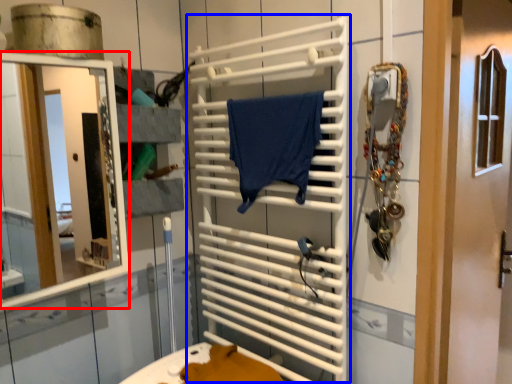
Question: Among these objects, which one is farthest to the camera, mirror (highlighted by a red box) or cage (highlighted by a blue box)?

Choices:
 (A) mirror
 (B) cage

Answer: (B)